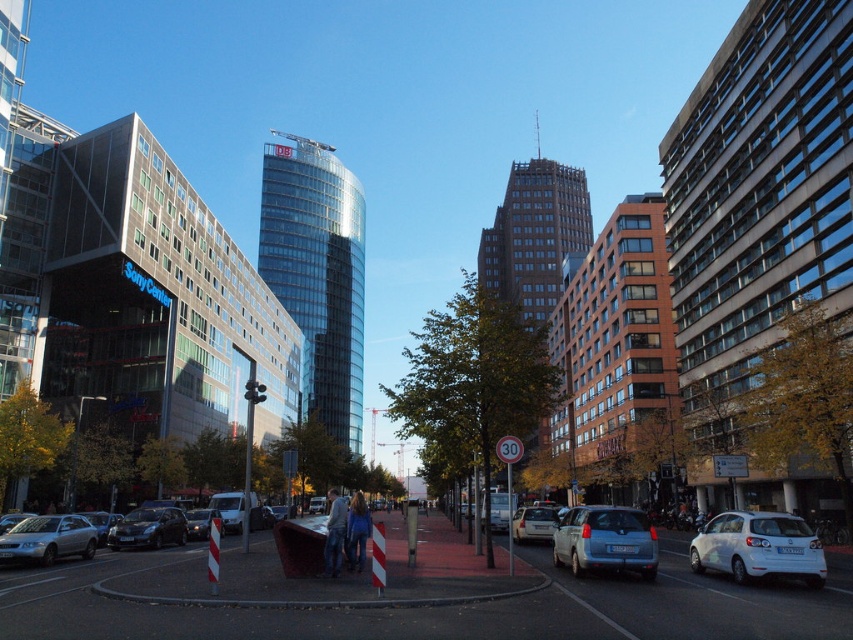
You are a delivery person needing to park your shiny silver sedan at lower left near the transparent glass tower at center. Based on the scene, can you park the car directly in front of the tower?

The transparent glass tower at center is to the left of the shiny silver sedan at lower left. Therefore, the shiny silver sedan at lower left is positioned to the right of the transparent glass tower at center, so you can park the car directly in front of the tower.

You are a delivery drone that needs to fly from your current position to deliver a package to the transparent glass tower at center. The drone has a maximum flight distance of 60 meters. Can you reach the tower without needing to recharge?

The transparent glass tower at center is 63.39 meters away from the viewer. Since the drone can only fly up to 60 meters before needing to recharge, it cannot reach the tower without recharging.

You are a delivery person who needs to park your vehicle in a tight space between two cars. You see a blue metallic van at center and a silver metallic sedan at lower left. Which vehicle should you avoid parking next to to ensure enough space?

You should avoid parking next to the blue metallic van at center because it is larger in size than the silver metallic sedan at lower left, leaving less space available.